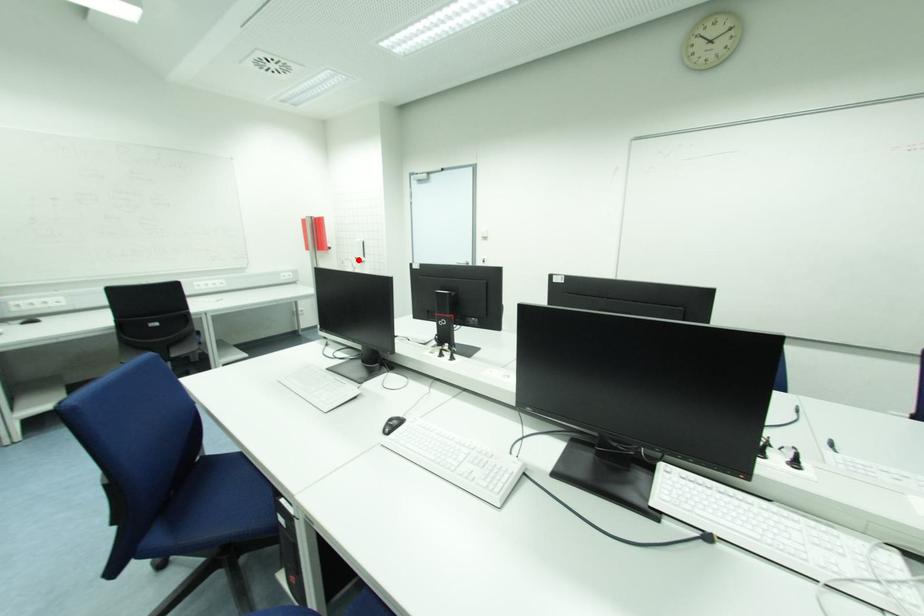
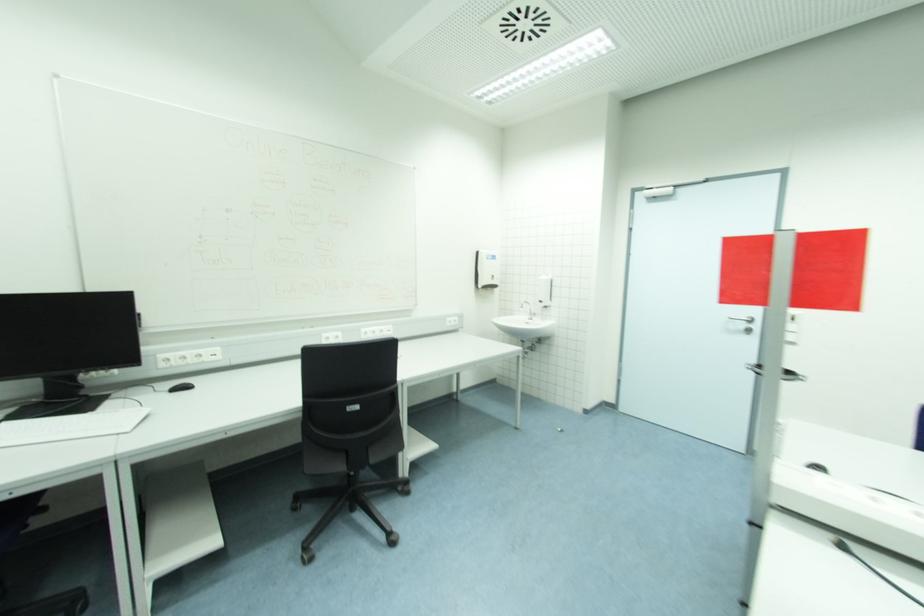
Question: I am providing you with two images of the same scene from different viewpoints. A red point is shown in image1. For the corresponding object point in image2, is it positioned nearer or farther from the camera?

Choices:
 (A) Nearer
 (B) Farther

Answer: (B)